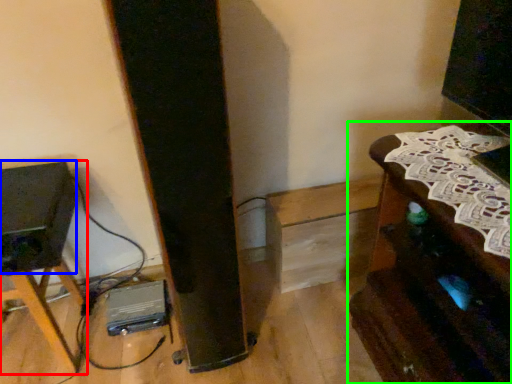
Question: Which object is positioned farthest from furniture (highlighted by a red box)? Select from speaker (highlighted by a blue box) and furniture (highlighted by a green box).

Choices:
 (A) speaker
 (B) furniture

Answer: (B)